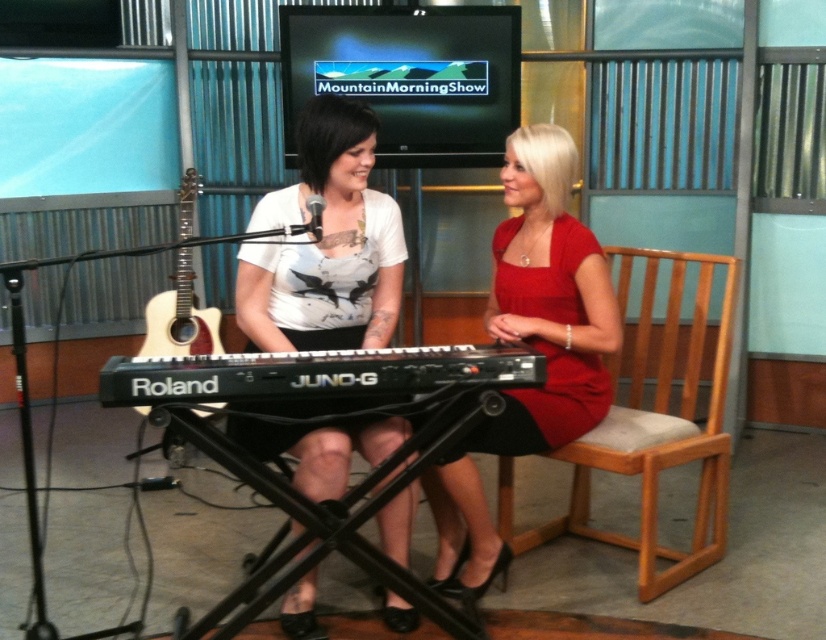
You are a stagehand setting up the Mountain Morning Show studio. You need to place a new decorative plant between the matte red dress at center and the acoustic wood guitar at left. Considering their sizes, which object should the plant be closer to?

The plant should be placed closer to the acoustic wood guitar at left because the matte red dress at center occupies less space, meaning the guitar is larger and thus the plant should be positioned nearer to the larger object to balance the setup.

Based on the photo, you are a camera operator filming the Mountain Morning Show. You need to focus on the light brown wood chair at right and the acoustic wood guitar at left. Which object is closer to the camera?

The light brown wood chair at right is closer to the camera because it is in front of the acoustic wood guitar at left.